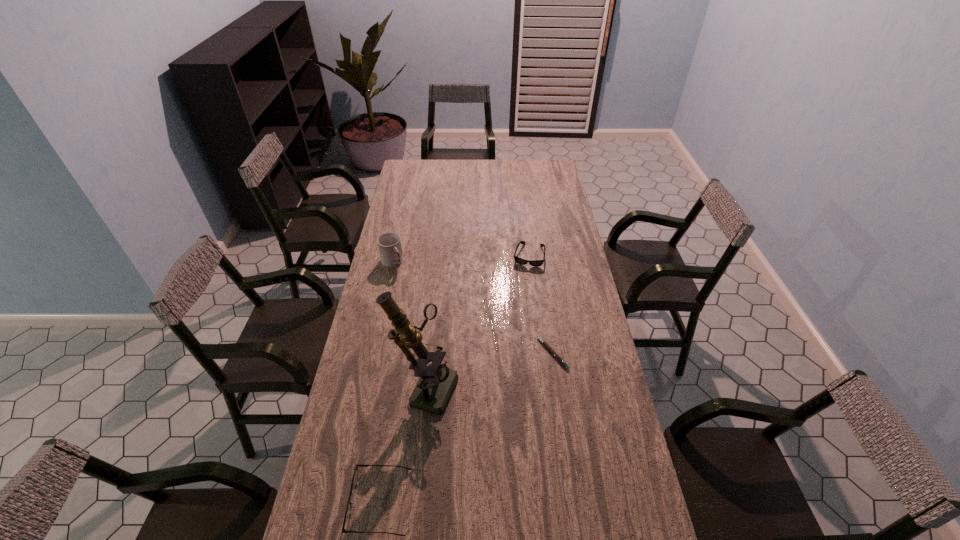
Where is `the nearest object`? The width and height of the screenshot is (960, 540). the nearest object is located at coordinates (355, 475).

This screenshot has width=960, height=540. In order to click on the shortest object in this screenshot , I will do `click(545, 344)`.

You are a GUI agent. You are given a task and a screenshot of the screen. Output one action in this format:
    pyautogui.click(x=<x>, y=<y>)
    Task: Click on the microscope
    The width and height of the screenshot is (960, 540).
    Given the screenshot: What is the action you would take?
    pyautogui.click(x=436, y=383)

Find the location of a particular element. This screenshot has width=960, height=540. the second tallest object is located at coordinates (389, 244).

You are a GUI agent. You are given a task and a screenshot of the screen. Output one action in this format:
    pyautogui.click(x=<x>, y=<y>)
    Task: Click on the sunglasses
    
    Given the screenshot: What is the action you would take?
    pyautogui.click(x=536, y=263)

Where is `free space located on the front-facing side of the nearest object`? This screenshot has height=540, width=960. free space located on the front-facing side of the nearest object is located at coordinates (323, 502).

The height and width of the screenshot is (540, 960). What are the coordinates of `free space located at the nib of the shortest object` in the screenshot? It's located at pos(444,353).

At what (x,y) coordinates should I click in order to perform the action: click on free space located 0.380m at the nib of the shortest object. Please return your answer as a coordinate pair (x, y). Looking at the image, I should click on (433, 353).

Identify the location of free location located at the nib of the shortest object. (467, 353).

Identify the location of vacant space located at the eyepiece of the microscope. This screenshot has height=540, width=960. (545, 421).